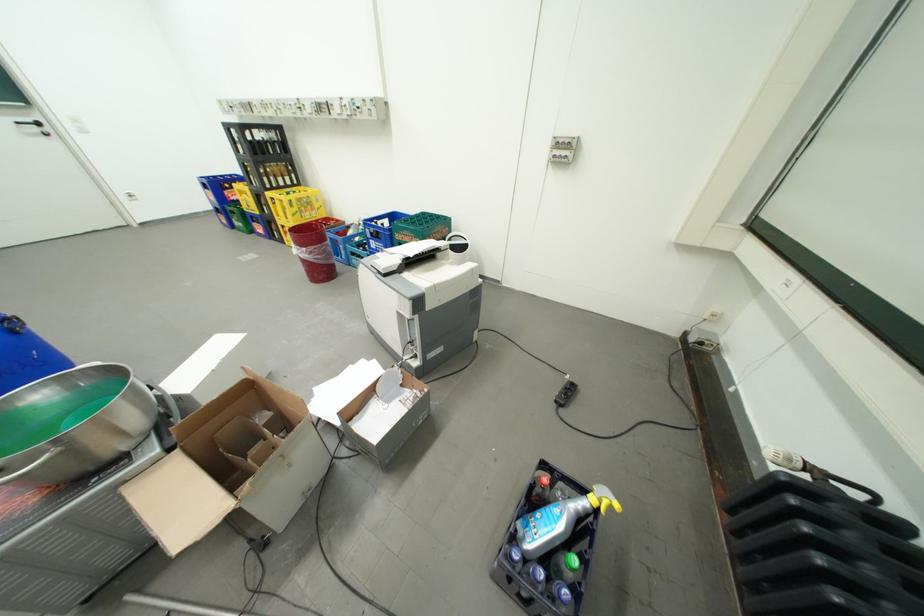
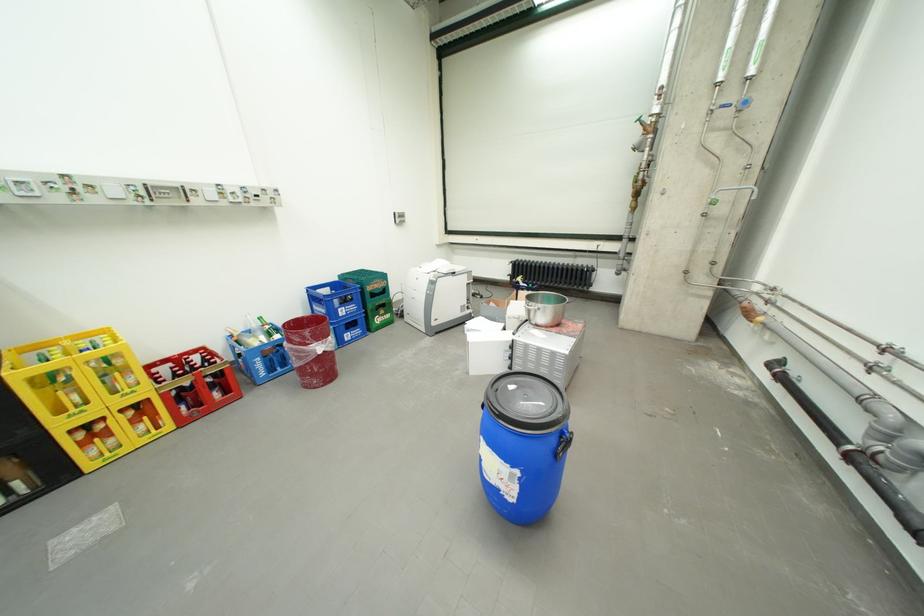
Where in the second image is the point corresponding to (417,237) from the first image?

(386, 285)